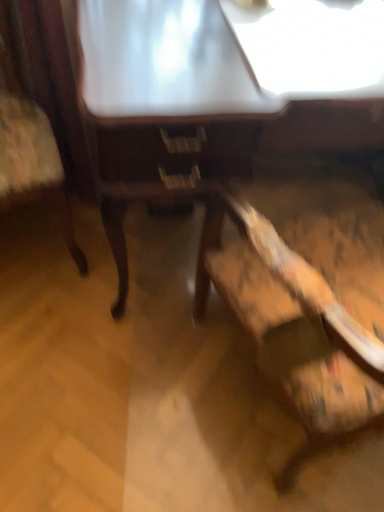
Find the location of `free spot above wooden table at center (from a real-world perspective)`. free spot above wooden table at center (from a real-world perspective) is located at coordinates (257, 37).